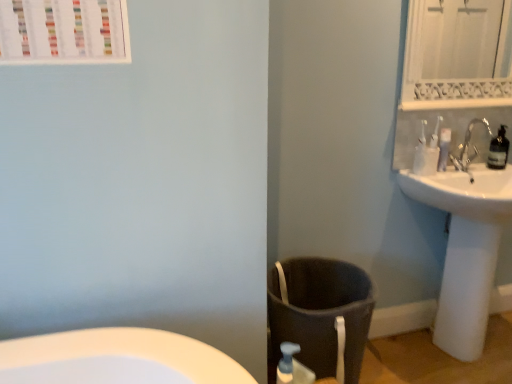
Question: Is transparent plastic bottle at upper right at the right side of white plastic toothbrushes at upper right?

Choices:
 (A) yes
 (B) no

Answer: (A)

Question: Is the surface of transparent plastic bottle at upper right in direct contact with white plastic toothbrushes at upper right?

Choices:
 (A) yes
 (B) no

Answer: (B)

Question: Is white plastic toothbrushes at upper right inside transparent plastic bottle at upper right?

Choices:
 (A) yes
 (B) no

Answer: (B)

Question: Does transparent plastic bottle at upper right lie behind white plastic toothbrushes at upper right?

Choices:
 (A) no
 (B) yes

Answer: (B)

Question: Considering the relative sizes of transparent plastic bottle at upper right and white plastic toothbrushes at upper right in the image provided, is transparent plastic bottle at upper right wider than white plastic toothbrushes at upper right?

Choices:
 (A) yes
 (B) no

Answer: (A)

Question: In the image, is dark gray fabric laundry basket at lower center on the left side or the right side of white glossy sink at right?

Choices:
 (A) left
 (B) right

Answer: (A)

Question: From a real-world perspective, is dark gray fabric laundry basket at lower center above or below white glossy sink at right?

Choices:
 (A) above
 (B) below

Answer: (B)

Question: Considering the positions of dark gray fabric laundry basket at lower center and white glossy sink at right in the image, is dark gray fabric laundry basket at lower center wider or thinner than white glossy sink at right?

Choices:
 (A) wide
 (B) thin

Answer: (A)

Question: From the image's perspective, relative to white glossy sink at right, is dark gray fabric laundry basket at lower center above or below?

Choices:
 (A) above
 (B) below

Answer: (B)

Question: Is white textured mirror at upper right bigger or smaller than dark gray fabric laundry basket at lower center?

Choices:
 (A) small
 (B) big

Answer: (A)

Question: Do you think white textured mirror at upper right is within dark gray fabric laundry basket at lower center, or outside of it?

Choices:
 (A) outside
 (B) inside

Answer: (A)

Question: Relative to dark gray fabric laundry basket at lower center, is white textured mirror at upper right in front or behind?

Choices:
 (A) behind
 (B) front

Answer: (A)

Question: Is white textured mirror at upper right wider or thinner than dark gray fabric laundry basket at lower center?

Choices:
 (A) wide
 (B) thin

Answer: (B)

Question: From a real-world perspective, relative to translucent plastic soap dispenser at lower center, is transparent plastic bottle at upper right vertically above or below?

Choices:
 (A) below
 (B) above

Answer: (B)

Question: Relative to translucent plastic soap dispenser at lower center, is transparent plastic bottle at upper right in front or behind?

Choices:
 (A) behind
 (B) front

Answer: (A)